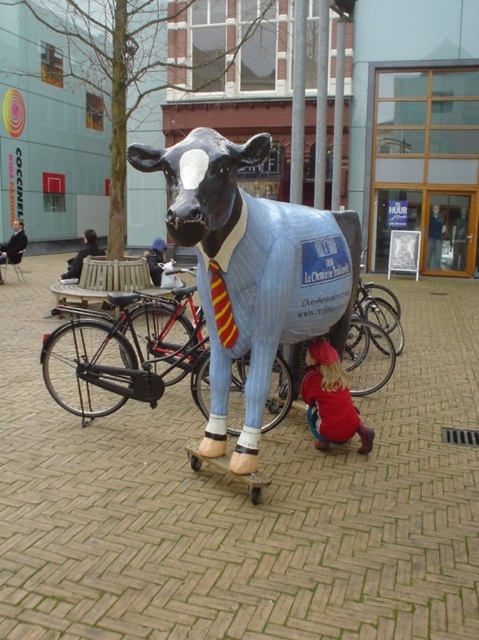
From the picture: Which of these two, yellow striped tie at center or dark blue suit at left, stands shorter?

yellow striped tie at center is shorter.

Is point (218, 272) behind point (22, 227)?

No, (218, 272) is closer to viewer.

The height and width of the screenshot is (640, 479). Identify the location of yellow striped tie at center. (221, 307).

Can you confirm if black matte bicycle at center is taller than yellow striped tie at center?

Yes.

Between black matte bicycle at center and yellow striped tie at center, which one appears on the left side from the viewer's perspective?

From the viewer's perspective, black matte bicycle at center appears more on the left side.

Who is more distant from viewer, (163, 332) or (224, 298)?

Positioned behind is point (163, 332).

Where is `black matte bicycle at center`? The width and height of the screenshot is (479, 640). black matte bicycle at center is located at coordinates (129, 353).

Which of these two, matte blue cow at center or red fabric dress at lower right, stands shorter?

Standing shorter between the two is red fabric dress at lower right.

You are a GUI agent. You are given a task and a screenshot of the screen. Output one action in this format:
    pyautogui.click(x=<x>, y=<y>)
    Task: Click on the matte blue cow at center
    The image size is (479, 640).
    Given the screenshot: What is the action you would take?
    pyautogui.click(x=253, y=268)

Identify the location of matte blue cow at center. The image size is (479, 640). (253, 268).